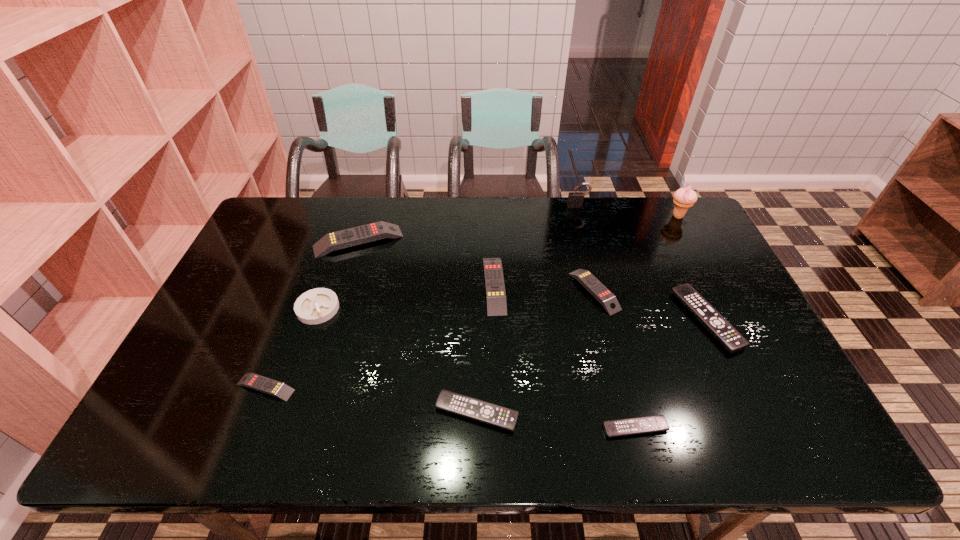
Identify the location of icecream. (684, 198).

Locate an element on the screen. the tallest object is located at coordinates (684, 198).

I want to click on padlock, so click(x=574, y=198).

I want to click on the farthest object, so click(574, 198).

Where is `the biggest yellow remote control`? The height and width of the screenshot is (540, 960). the biggest yellow remote control is located at coordinates (354, 236).

Where is `the eighth shortest object`? the eighth shortest object is located at coordinates (354, 236).

This screenshot has height=540, width=960. I want to click on ashtray, so click(318, 305).

Where is `the second tallest remote control`? The image size is (960, 540). the second tallest remote control is located at coordinates (493, 273).

Find the location of `the third yellow remote control from left to right`. the third yellow remote control from left to right is located at coordinates (493, 273).

Find the location of a particular element. the rightmost yellow remote control is located at coordinates (608, 300).